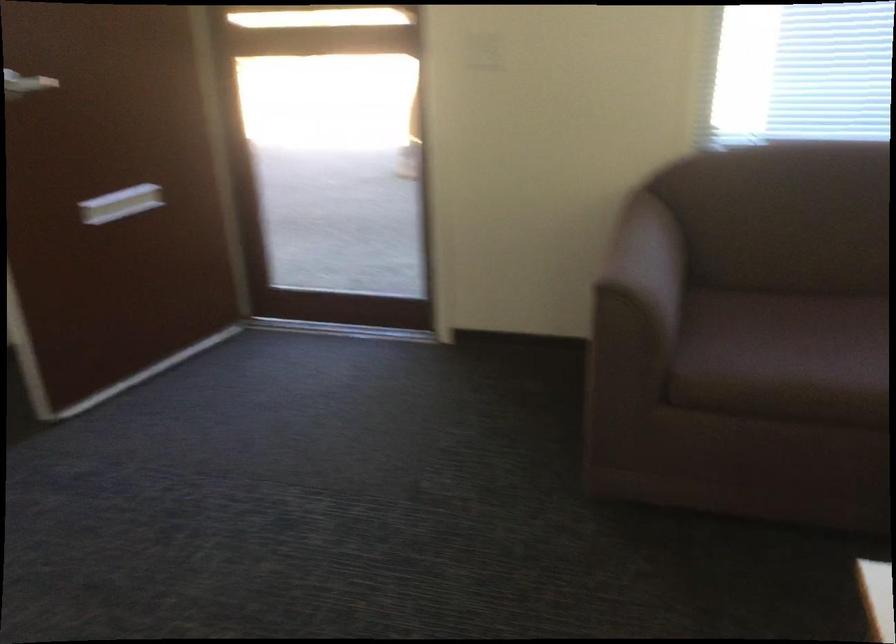
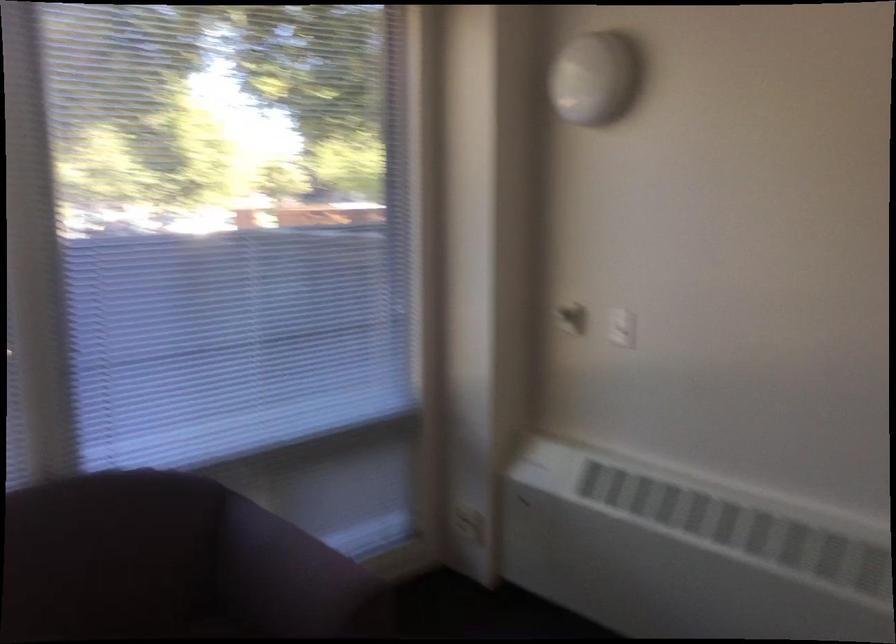
Question: The images are taken continuously from a first-person perspective. In which direction is your viewpoint rotating?

Choices:
 (A) Left
 (B) Right
 (C) Up
 (D) Down

Answer: (B)